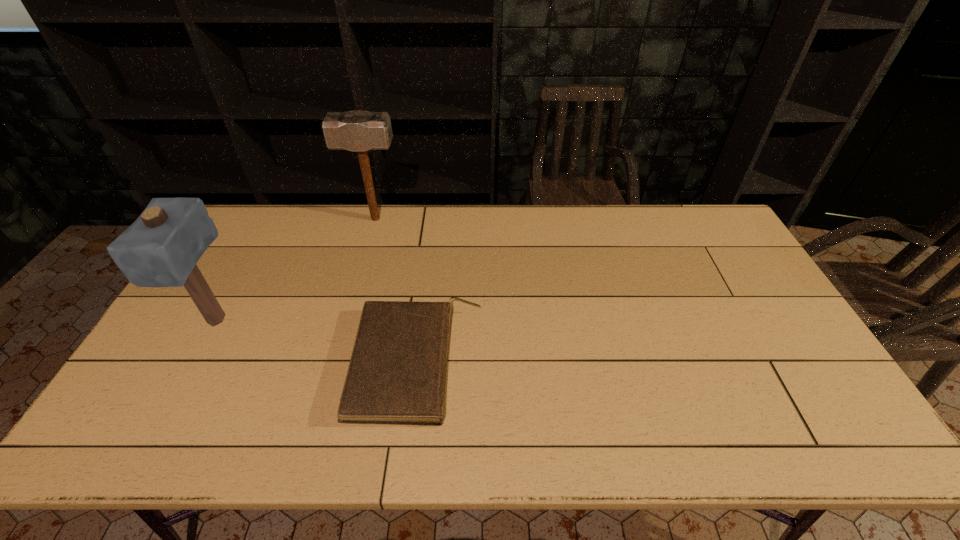
At what (x,y) coordinates should I click in order to perform the action: click on free space between the shortest object and the left mallet. Please return your answer as a coordinate pair (x, y). Looking at the image, I should click on (317, 342).

I want to click on free space that is in between the nearer mallet and the farther mallet, so point(296,270).

You are a GUI agent. You are given a task and a screenshot of the screen. Output one action in this format:
    pyautogui.click(x=<x>, y=<y>)
    Task: Click on the vacant area between the left mallet and the farthest object
    
    Given the screenshot: What is the action you would take?
    pyautogui.click(x=296, y=270)

Find the location of a particular element. The image size is (960, 540). free point between the leftmost object and the shortest object is located at coordinates (317, 342).

Image resolution: width=960 pixels, height=540 pixels. What are the coordinates of `free area in between the shortest object and the farthest object` in the screenshot? It's located at pos(396,291).

Locate an element on the screen. The image size is (960, 540). the closest object to the left mallet is located at coordinates tap(397, 372).

Point out which object is positioned as the nearest to the farthest object. Please provide its 2D coordinates. Your answer should be formatted as a tuple, i.e. [(x, y)], where the tuple contains the x and y coordinates of a point satisfying the conditions above.

[(397, 372)]